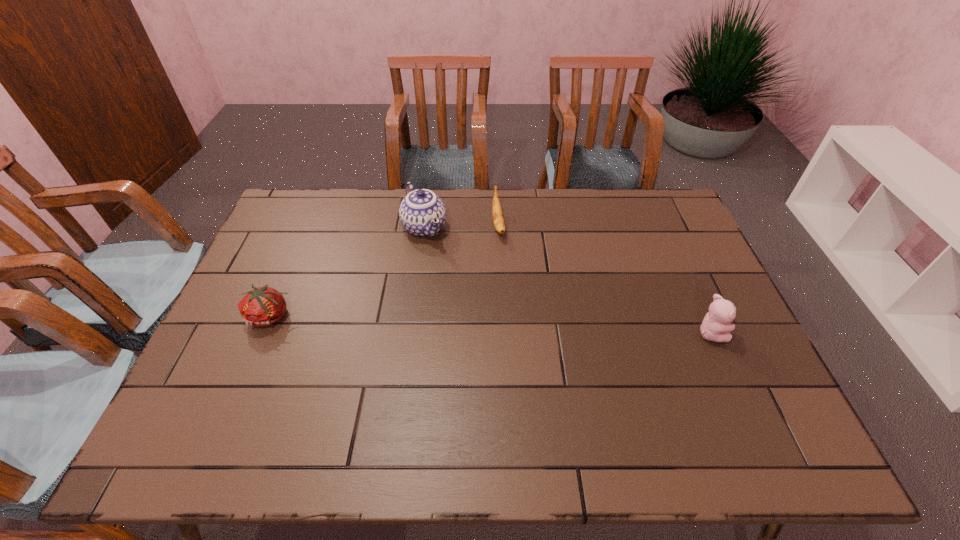
Where is `tomato`? The width and height of the screenshot is (960, 540). tomato is located at coordinates (263, 306).

Locate an element on the screen. This screenshot has width=960, height=540. teddy bear is located at coordinates (716, 326).

The height and width of the screenshot is (540, 960). What are the coordinates of `the rightmost object` in the screenshot? It's located at (716, 326).

Locate an element on the screen. This screenshot has width=960, height=540. banana is located at coordinates pos(498,220).

Where is `chinaware`? chinaware is located at coordinates [422, 213].

Where is `the tallest object`? The width and height of the screenshot is (960, 540). the tallest object is located at coordinates (422, 213).

This screenshot has height=540, width=960. Identify the location of free space located on the front-facing side of the leftmost object. (242, 383).

Where is `vacant space located on the peel of the third object from left to right from the top`? vacant space located on the peel of the third object from left to right from the top is located at coordinates (x=504, y=265).

Find the location of a particular element. This screenshot has height=540, width=960. vacant point located 0.360m on the peel of the third object from left to right from the top is located at coordinates (516, 333).

At what (x,y) coordinates should I click in order to perform the action: click on vacant space located 0.090m on the peel of the third object from left to right from the top. Please return your answer as a coordinate pair (x, y). The width and height of the screenshot is (960, 540). Looking at the image, I should click on click(503, 263).